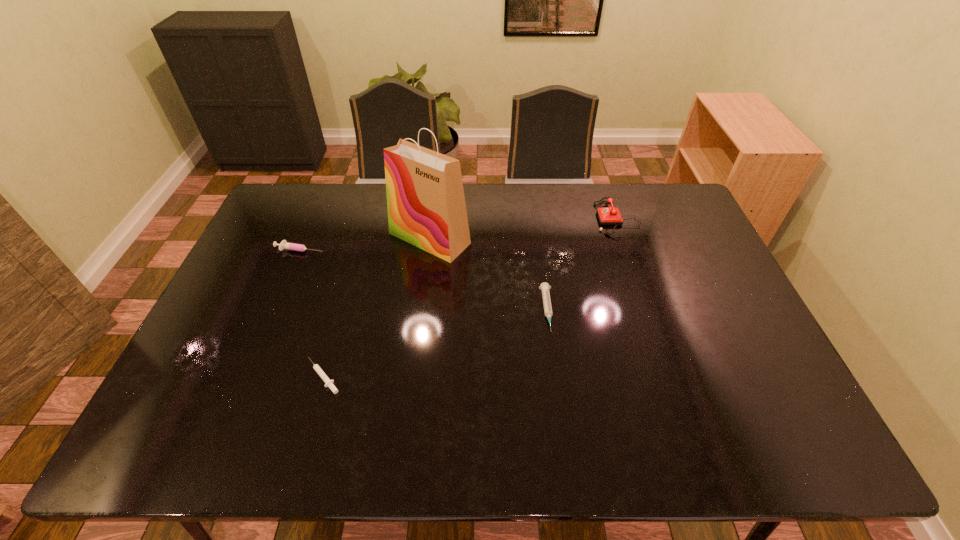
Identify the location of the tallest object. (426, 206).

What are the coordinates of `shopping bag` in the screenshot? It's located at (426, 206).

Where is `telephone`? This screenshot has height=540, width=960. telephone is located at coordinates (x=611, y=215).

Locate an element on the screen. the rightmost object is located at coordinates (611, 215).

Identify the location of the leftmost syringe. This screenshot has width=960, height=540. (284, 244).

I want to click on the leftmost object, so click(x=284, y=244).

This screenshot has height=540, width=960. I want to click on the fourth object from left to right, so click(x=545, y=287).

You are a GUI agent. You are given a task and a screenshot of the screen. Output one action in this format:
    pyautogui.click(x=<x>, y=<y>)
    Task: Click on the rightmost syringe
    This screenshot has height=540, width=960.
    Given the screenshot: What is the action you would take?
    pyautogui.click(x=545, y=287)

Locate an element on the screen. the shortest object is located at coordinates [329, 383].

Where is `the shortest syringe`? the shortest syringe is located at coordinates (329, 383).